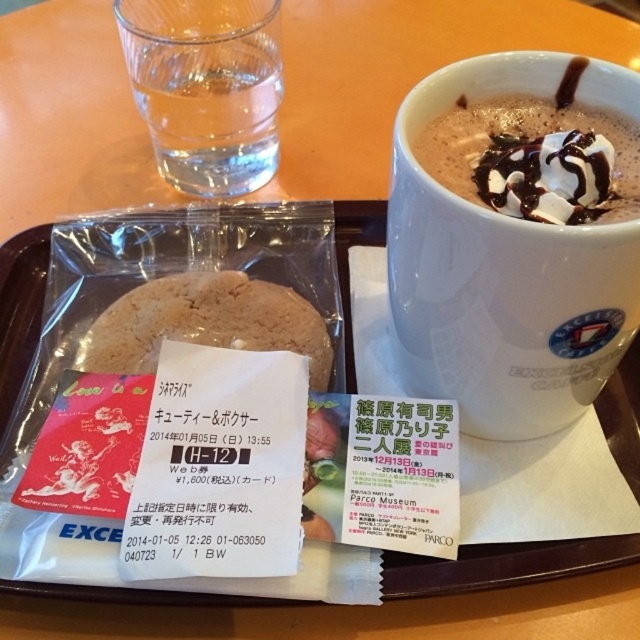
You are a barista who needs to place a new cup that is 10 cm in diameter on the tray. The tray has the clear glass water at upper left and the chocolate frothy beverage at upper right. Which object should you move to make space?

The clear glass water at upper left has a smaller width than the chocolate frothy beverage at upper right. Since the new cup is 10 cm in diameter, moving the clear glass water at upper left would free up more space as it is narrower, allowing the new cup to fit better next to the wider chocolate frothy beverage at upper right.

You are a customer at the cafe and want to place your phone between the biscuit at center and the chocolate frothy beverage at upper right. Is there enough space for your phone?

The biscuit at center is positioned on the left side of chocolate frothy beverage at upper right, so there is space between them to place your phone.